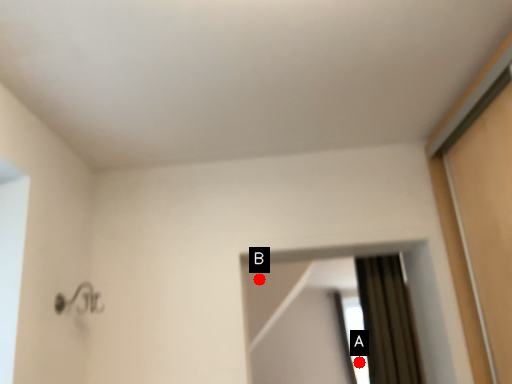
Question: Two points are circled on the image, labeled by A and B beside each circle. Which point appears closest to the camera in this image?

Choices:
 (A) A is closer
 (B) B is closer

Answer: (B)